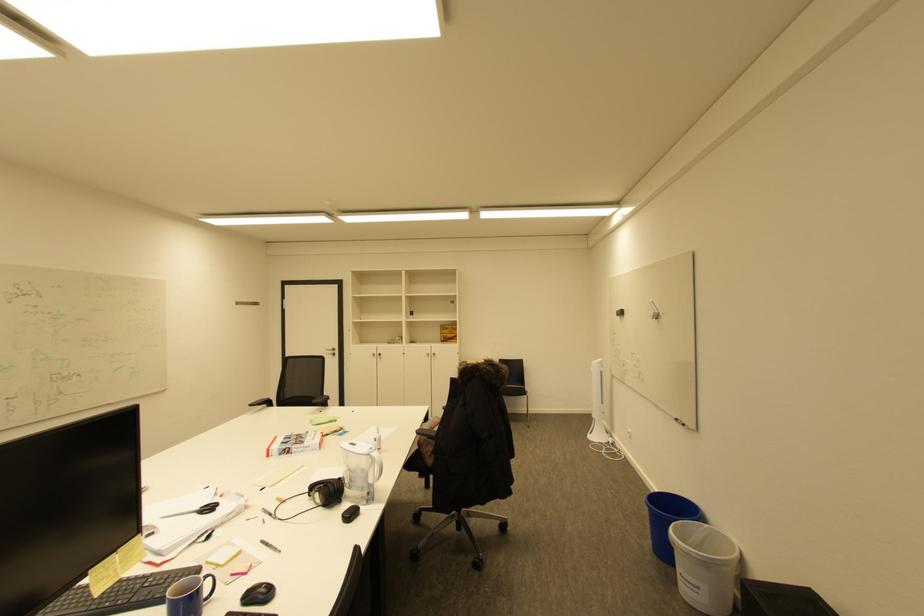
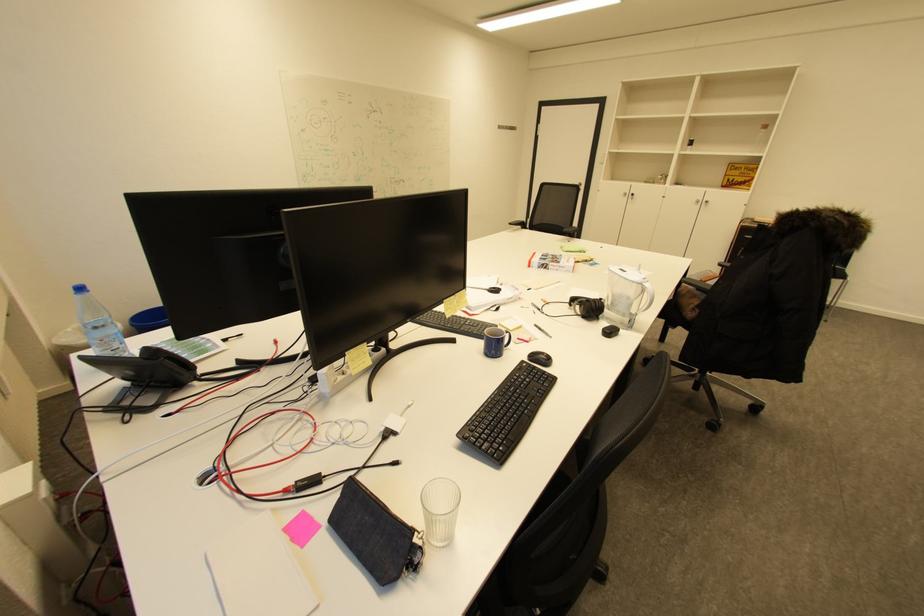
Find the pixel in the second image that matches (x=258, y=406) in the first image.

(517, 225)